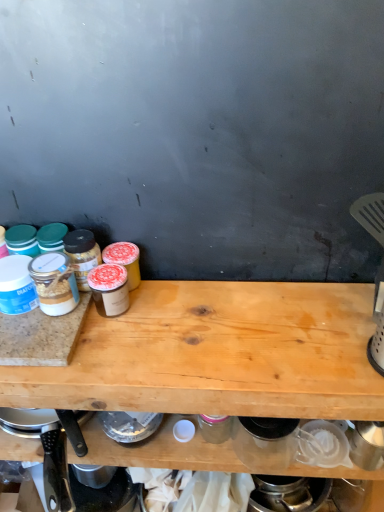
Identify the location of empty space that is ontop of light brown wood at center (from a real-world perspective). The image size is (384, 512). (206, 326).